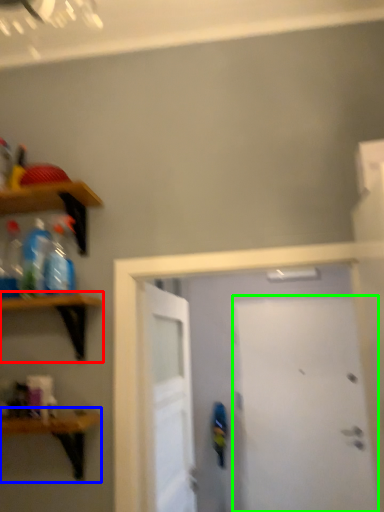
Question: Which is farther away from shelf (highlighted by a red box)? shelf (highlighted by a blue box) or door (highlighted by a green box)?

Choices:
 (A) shelf
 (B) door

Answer: (B)